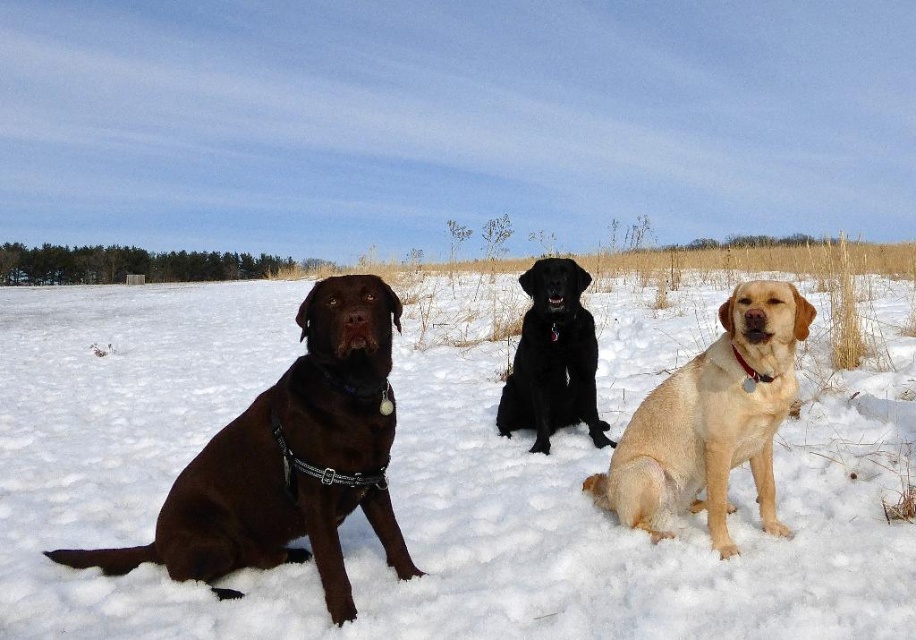
Question: Is shiny brown dog at left below golden fur dog at center?

Choices:
 (A) no
 (B) yes

Answer: (B)

Question: Estimate the real-world distances between objects in this image. Which object is farther from the golden fur dog at center?

Choices:
 (A) shiny brown dog at left
 (B) black glossy dog at center
 (C) white fluffy snow at center

Answer: (C)

Question: Based on their relative distances, which object is farther from the golden fur dog at center?

Choices:
 (A) white fluffy snow at center
 (B) shiny brown dog at left
 (C) black glossy dog at center

Answer: (A)

Question: Does white fluffy snow at center have a smaller size compared to shiny brown dog at left?

Choices:
 (A) yes
 (B) no

Answer: (B)

Question: Based on their relative distances, which object is farther from the white fluffy snow at center?

Choices:
 (A) golden fur dog at center
 (B) shiny brown dog at left

Answer: (A)

Question: Does white fluffy snow at center appear on the right side of shiny brown dog at left?

Choices:
 (A) yes
 (B) no

Answer: (A)